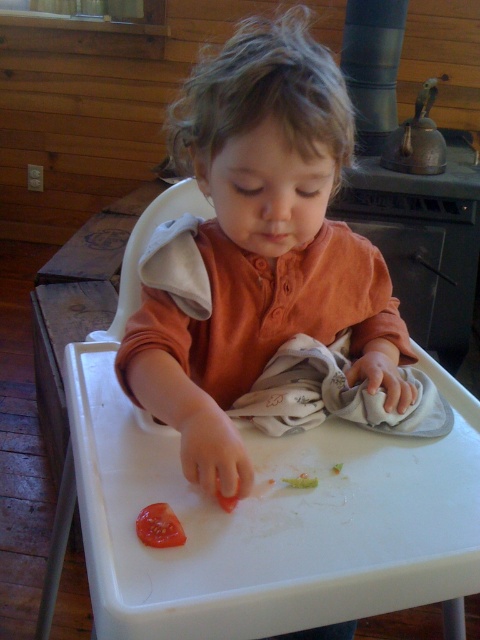
Question: In this image, where is matte orange shirt at center located relative to juicy red tomato at lower center?

Choices:
 (A) above
 (B) below

Answer: (A)

Question: Is matte orange shirt at center smaller than juicy red tomato at lower center?

Choices:
 (A) no
 (B) yes

Answer: (A)

Question: Among these points, which one is farthest from the camera?

Choices:
 (A) (151, 538)
 (B) (257, 120)

Answer: (B)

Question: Which point is closer to the camera taking this photo?

Choices:
 (A) (195, 333)
 (B) (180, 545)

Answer: (B)

Question: Can you confirm if matte orange shirt at center is positioned to the left of juicy red tomato at lower center?

Choices:
 (A) yes
 (B) no

Answer: (B)

Question: Which point is farther to the camera?

Choices:
 (A) matte orange shirt at center
 (B) juicy red tomato at lower center

Answer: (A)